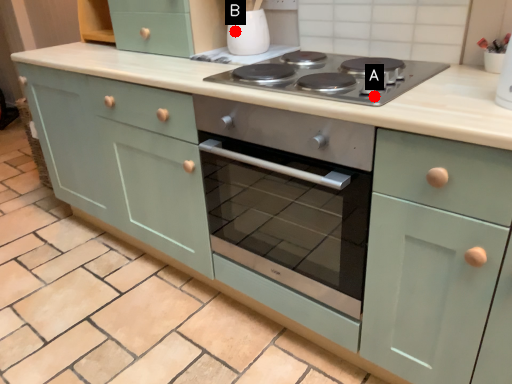
Question: Two points are circled on the image, labeled by A and B beside each circle. Which of the following is the farthest from the observer?

Choices:
 (A) A is further
 (B) B is further

Answer: (B)